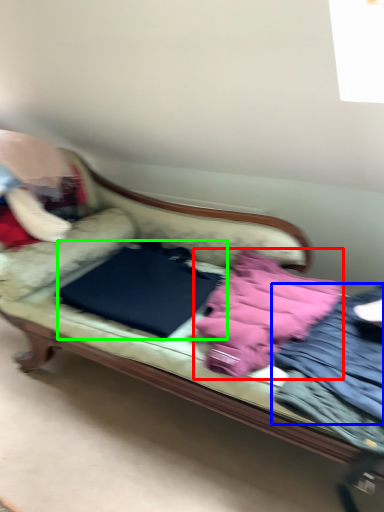
Question: Based on their relative distances, which object is nearer to material (highlighted by a red box)? Choose from clothing (highlighted by a blue box) and sheet (highlighted by a green box).

Choices:
 (A) clothing
 (B) sheet

Answer: (A)